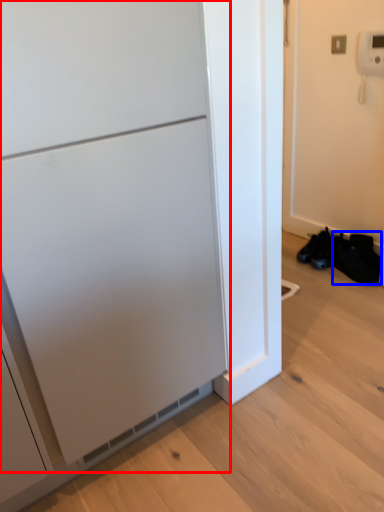
Question: Which point is closer to the camera, appliance (highlighted by a red box) or shoe (highlighted by a blue box)?

Choices:
 (A) appliance
 (B) shoe

Answer: (A)